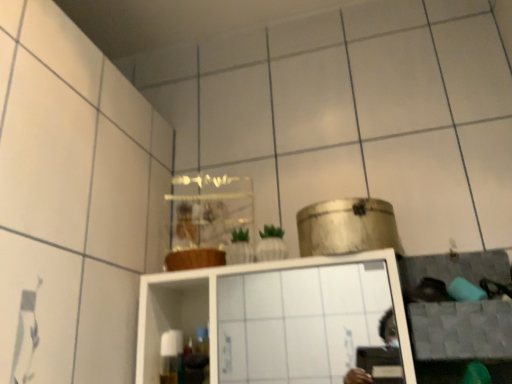
Describe the element at coordinates (276, 317) in the screenshot. I see `white glossy medicine cabinet at center` at that location.

This screenshot has width=512, height=384. What are the coordinates of `white glossy medicine cabinet at center` in the screenshot? It's located at (276, 317).

This screenshot has height=384, width=512. I want to click on white glossy medicine cabinet at center, so [276, 317].